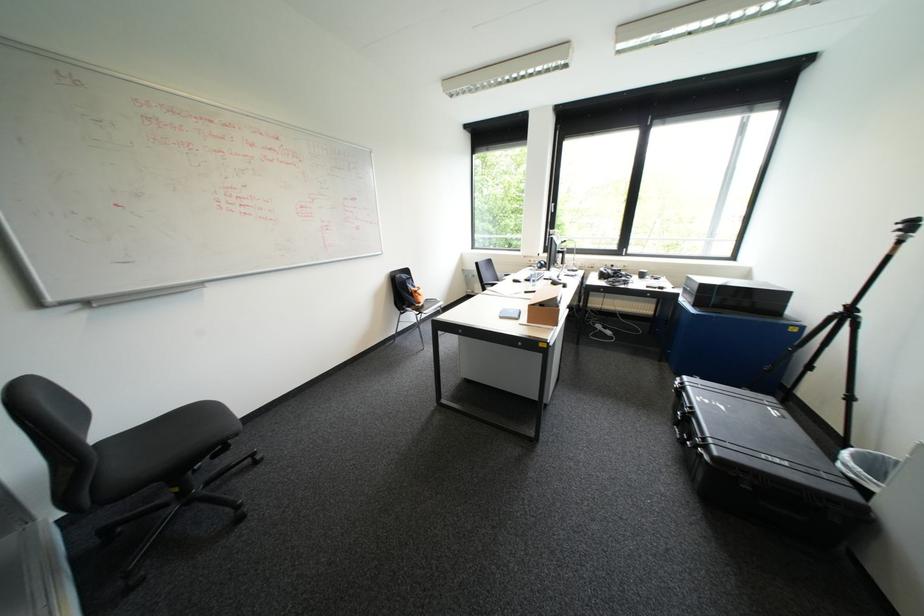
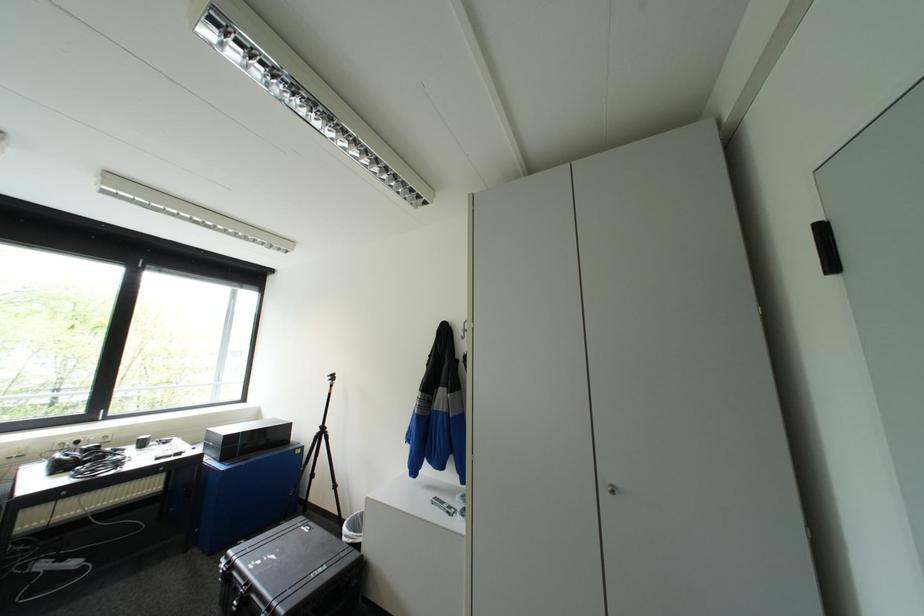
Question: The camera is either moving clockwise (left) or counter-clockwise (right) around the object. The first image is from the beginning of the video and the second image is from the end. Is the camera moving left or right when shooting the video?

Choices:
 (A) Left
 (B) Right

Answer: (A)